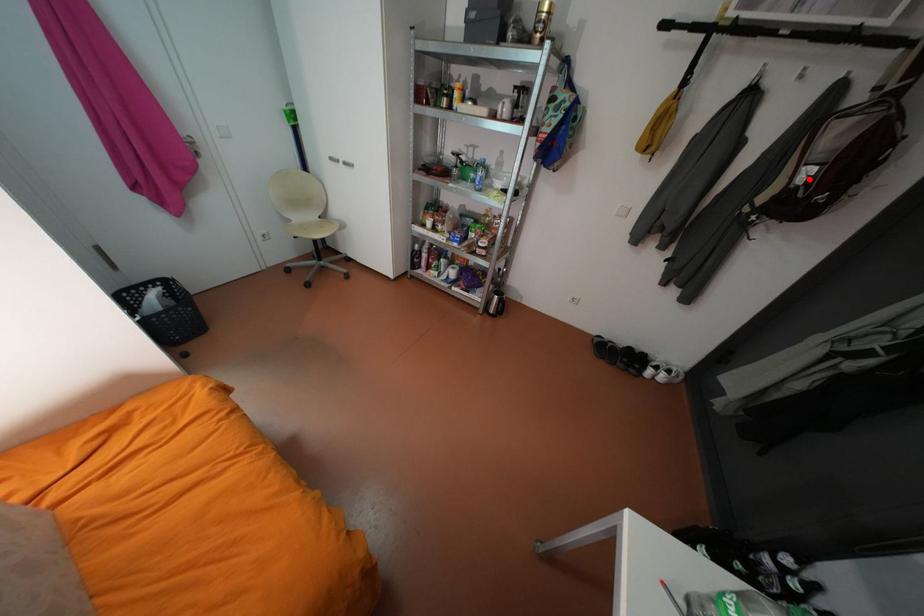
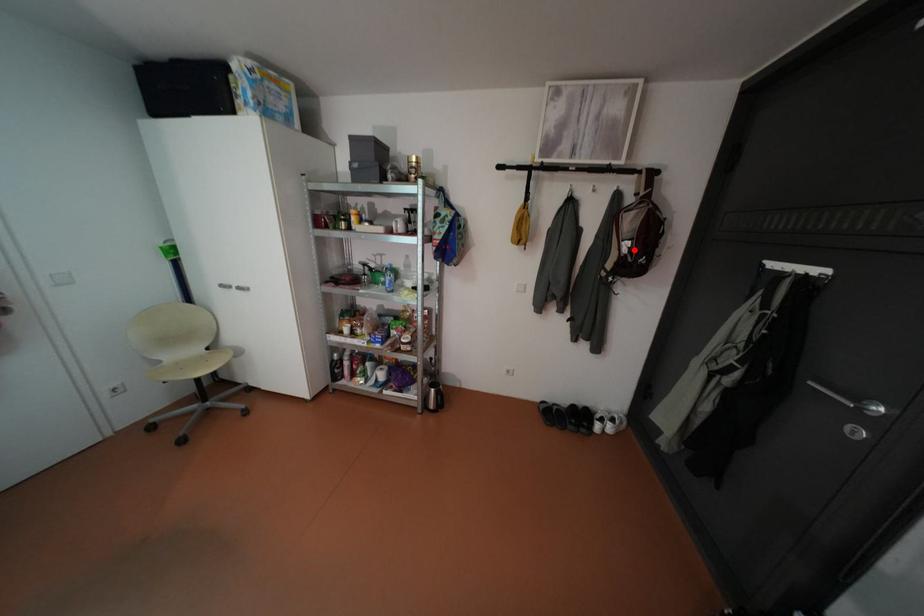
I am providing you with two images of the same scene from different viewpoints. A red point is marked on the first image and another point is marked on the second image. Do the highlighted points in image1 and image2 indicate the same real-world spot?

Yes